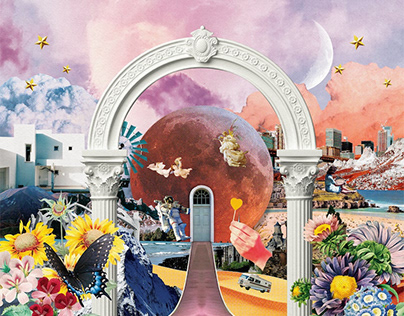
The image size is (404, 316). I want to click on moulding, so click(181, 65), click(227, 51), click(172, 51), click(116, 86), click(285, 88).